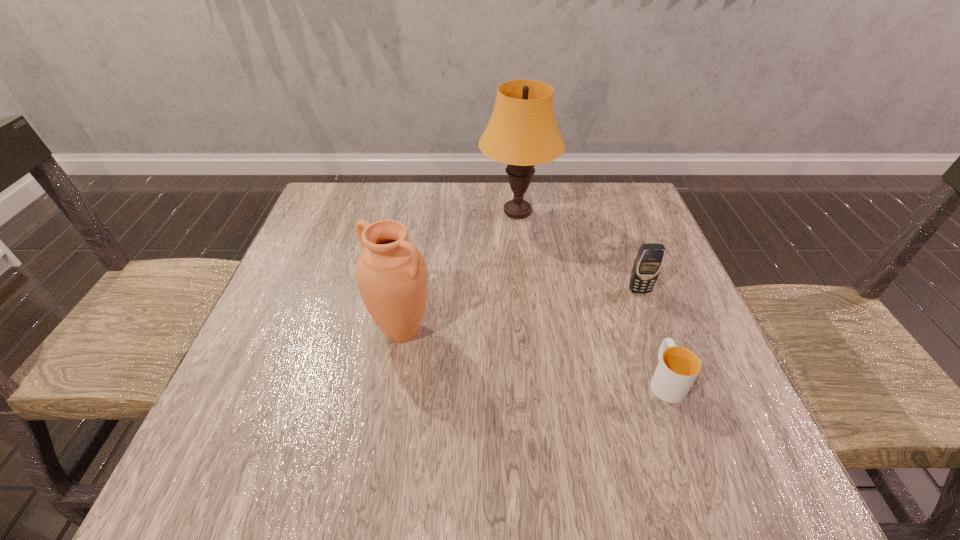
Locate an element on the screen. Image resolution: width=960 pixels, height=540 pixels. lampshade is located at coordinates (522, 132).

Locate an element on the screen. The width and height of the screenshot is (960, 540). the farthest object is located at coordinates (522, 132).

Identify the location of the third shortest object. The width and height of the screenshot is (960, 540). click(x=391, y=273).

Where is `the third farthest object`? the third farthest object is located at coordinates (391, 273).

The height and width of the screenshot is (540, 960). I want to click on cellular telephone, so click(649, 260).

Where is `the second farthest object`? The image size is (960, 540). the second farthest object is located at coordinates (649, 260).

The image size is (960, 540). Identify the location of the nearest object. (678, 367).

This screenshot has width=960, height=540. Find the location of `the shortest object`. the shortest object is located at coordinates (678, 367).

Locate an element on the screen. The width and height of the screenshot is (960, 540). vacant position located on the front of the tallest object is located at coordinates (525, 287).

At what (x,y) coordinates should I click in order to perform the action: click on vacant space located on the front of the urn. Please return your answer as a coordinate pair (x, y). The image size is (960, 540). Looking at the image, I should click on (391, 403).